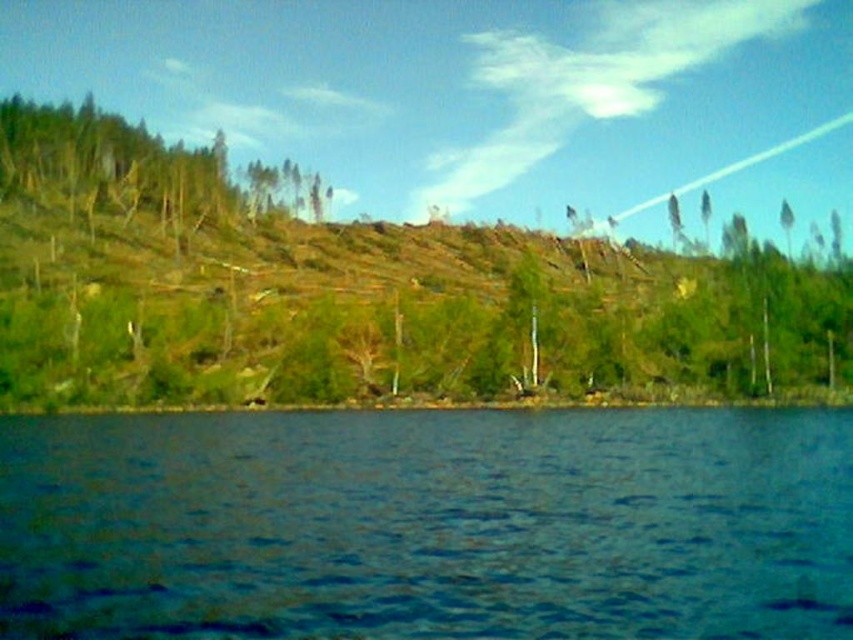
Question: Which object is farther from the camera taking this photo?

Choices:
 (A) green matte tree at upper left
 (B) blue liquid water at lower center

Answer: (A)

Question: Does blue liquid water at lower center appear on the right side of green matte tree at upper left?

Choices:
 (A) yes
 (B) no

Answer: (A)

Question: Is blue liquid water at lower center bigger than green matte tree at upper left?

Choices:
 (A) no
 (B) yes

Answer: (A)

Question: Among these points, which one is farthest from the camera?

Choices:
 (A) (790, 422)
 (B) (35, 113)

Answer: (B)

Question: Can you confirm if blue liquid water at lower center is positioned below green matte tree at upper left?

Choices:
 (A) no
 (B) yes

Answer: (B)